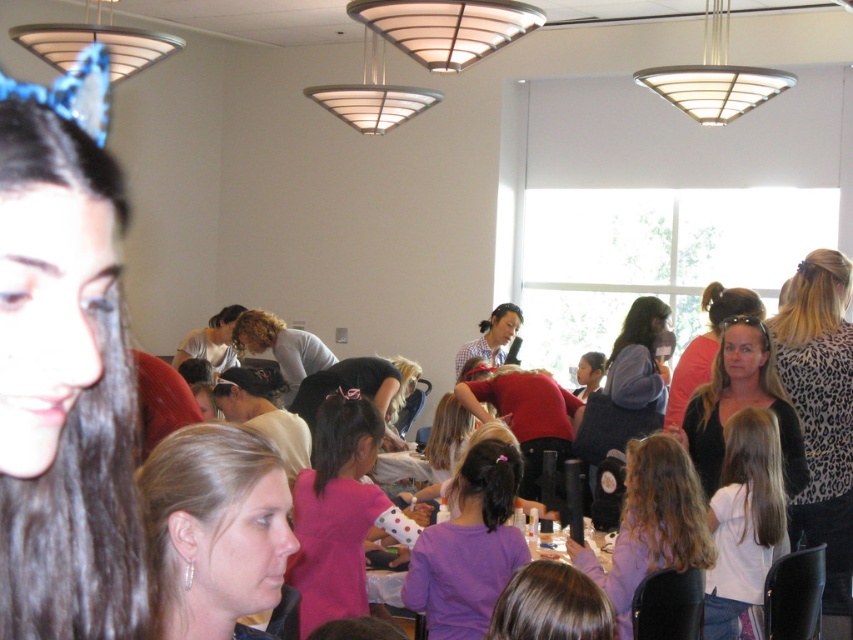
You are standing in the room and want to find the leopard print shirt at right. Where should you look?

You should look at point (x=820, y=412) to find the leopard print shirt at right.

You are standing at the entrance of the room and want to locate the leopard print shirt at right. According to the coordinates, where would you find it?

The leopard print shirt at right is located at the coordinates point (820, 412), which is on the right side of the image near the bottom.